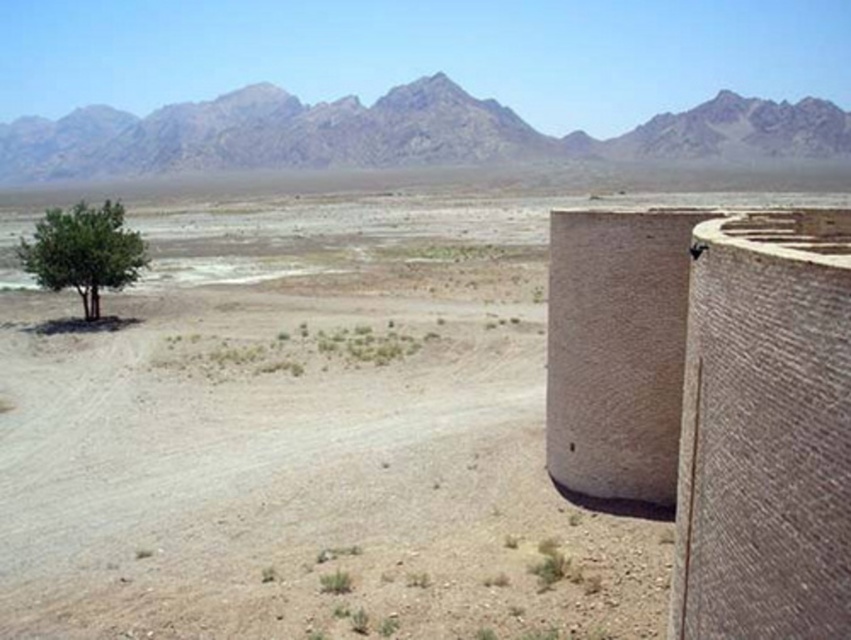
You are planning to build a sandcastle near the brown textured fort at right and the rugged stone mountain at upper center. Which structure should you avoid building too close to if you want your sandcastle to be visible from a distance?

You should avoid building too close to the rugged stone mountain at upper center because the brown textured fort at right is not as tall as rugged stone mountain at upper center, so the mountain would block the view of the sandcastle more effectively.

You are standing in the desert and see the brown textured fort at right. If you walk straight ahead, will you reach the fort before or after passing the tree on the left side?

The brown textured fort at right is 29.29 feet away from you. Since the tree on the left is part of the middle ground and the fort is in the foreground, you would reach the fort before passing the tree on the left side.

From the picture: You are an explorer standing at the base of the rugged stone mountain at upper center and want to reach the brown textured fort at right. Which direction should you move to get closer to the fort?

The brown textured fort at right is closer to the viewer than the rugged stone mountain at upper center, so you should move away from the mountain towards the fort.